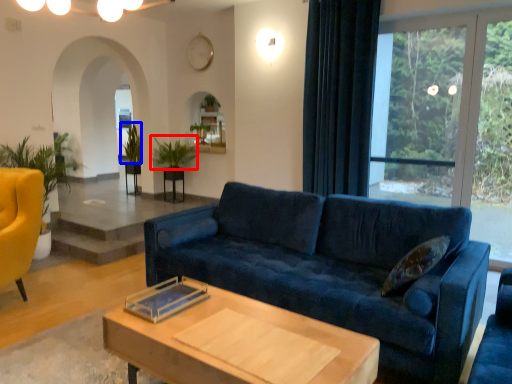
Question: Which object appears closest to the camera in this image, plant (highlighted by a red box) or plant (highlighted by a blue box)?

Choices:
 (A) plant
 (B) plant

Answer: (A)